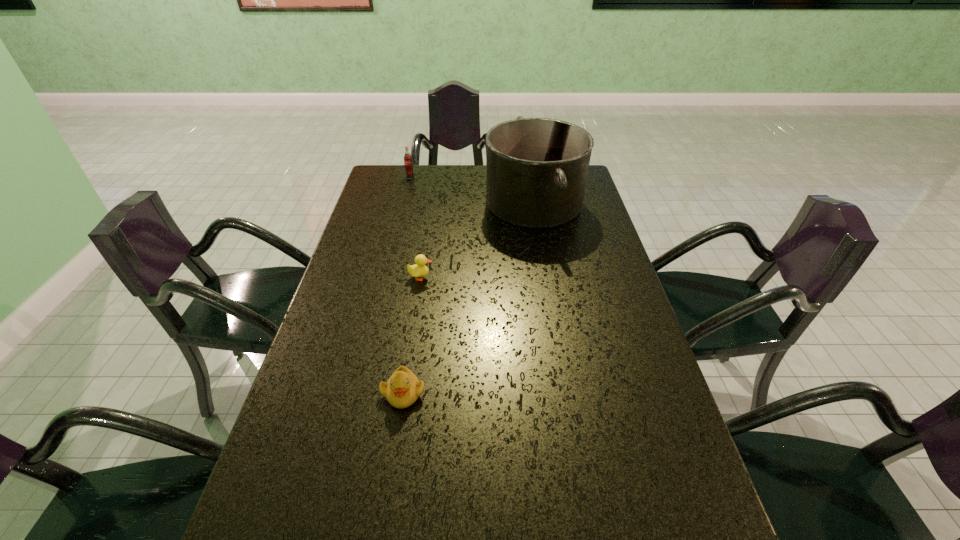
I want to click on the rightmost object, so point(537,168).

You are a GUI agent. You are given a task and a screenshot of the screen. Output one action in this format:
    pyautogui.click(x=<x>, y=<y>)
    Task: Click on the pan
    
    Given the screenshot: What is the action you would take?
    pyautogui.click(x=537, y=168)

At what (x,y) coordinates should I click in order to perform the action: click on soda bottle. Please return your answer as a coordinate pair (x, y). Looking at the image, I should click on (408, 164).

Locate an element on the screen. the leftmost object is located at coordinates (408, 164).

The image size is (960, 540). In order to click on the second nearest object in this screenshot , I will do `click(419, 269)`.

This screenshot has width=960, height=540. I want to click on the nearer duckling, so click(x=403, y=388).

Locate an element on the screen. This screenshot has width=960, height=540. vacant region located on the front of the tallest object is located at coordinates (552, 309).

What are the coordinates of `free space located on the label of the third shortest object` in the screenshot? It's located at [x=403, y=204].

You are a GUI agent. You are given a task and a screenshot of the screen. Output one action in this format:
    pyautogui.click(x=<x>, y=<y>)
    Task: Click on the vacant point located 0.260m on the front-facing side of the third farthest object
    This screenshot has height=540, width=960.
    Given the screenshot: What is the action you would take?
    pyautogui.click(x=522, y=278)

Find the location of a particular element. vacant region located at the beak of the nearest object is located at coordinates (392, 470).